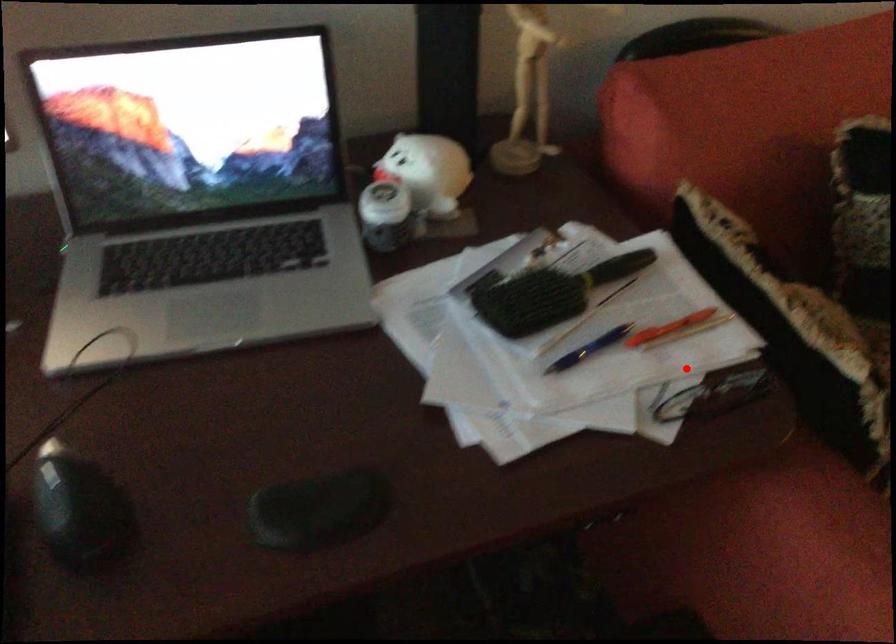
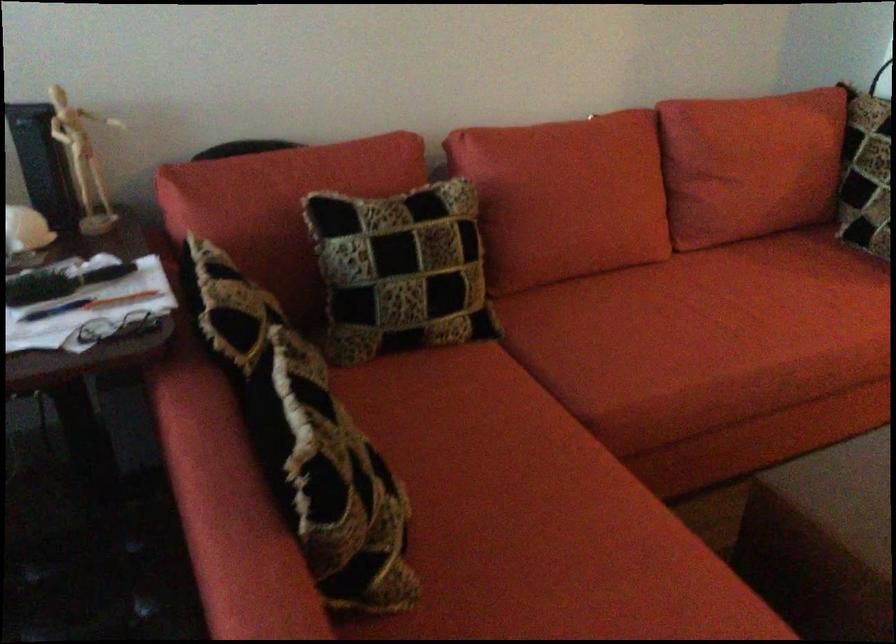
Question: I am providing you with two images of the same scene from different viewpoints. In image1, a red point is highlighted. Considering the same 3D point in image2, which of the following is correct?

Choices:
 (A) It is closer
 (B) It is farther

Answer: (B)